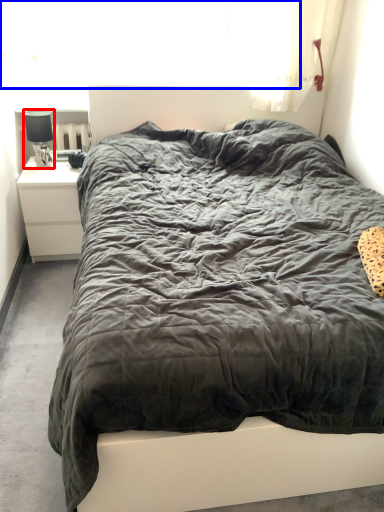
Question: Which point is further to the camera, lamp (highlighted by a red box) or window screen (highlighted by a blue box)?

Choices:
 (A) lamp
 (B) window screen

Answer: (B)